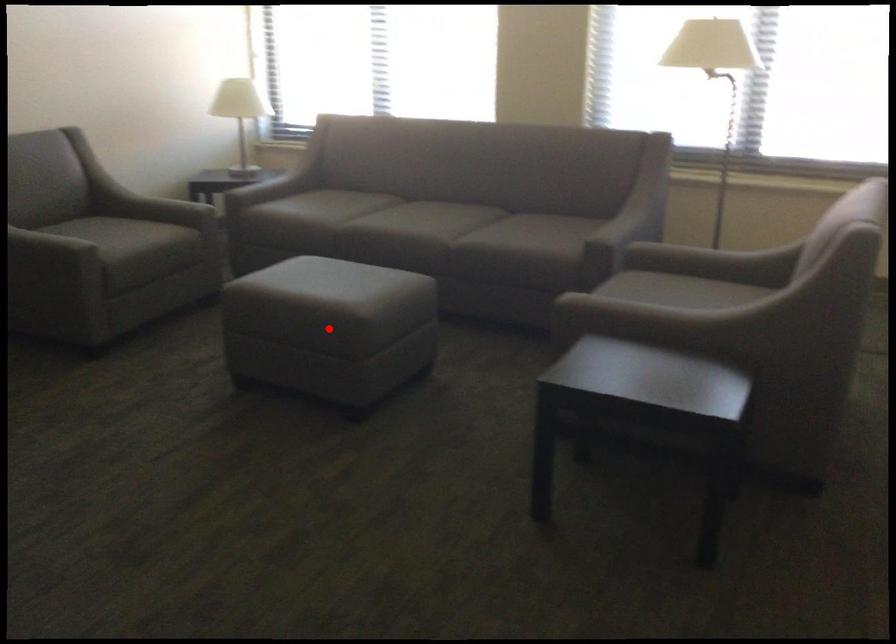
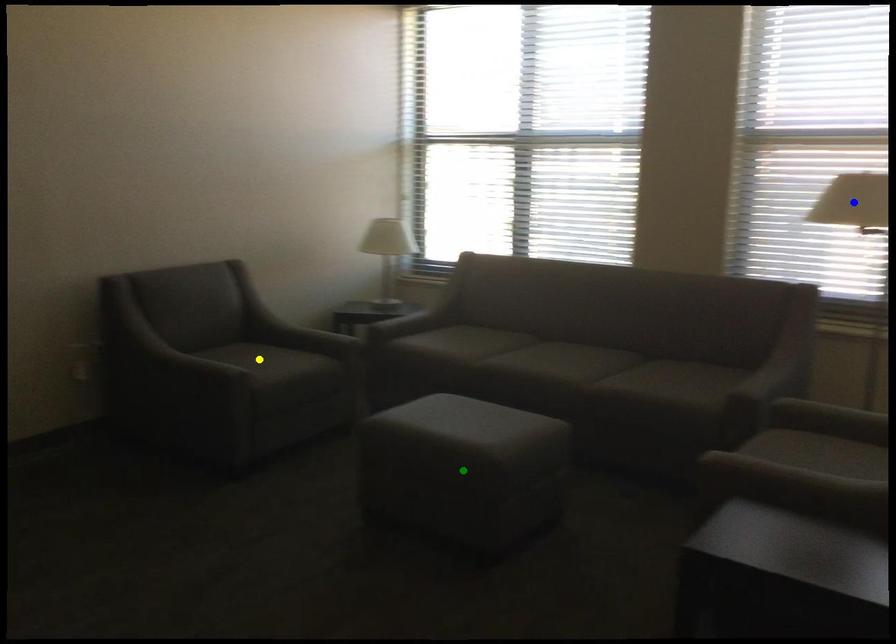
Question: I am providing you with two images of the same scene from different viewpoints. A red point is marked on the first image. You are given multiple points on the second image. Which mark in image 2 goes with the point in image 1?

Choices:
 (A) yellow point
 (B) green point
 (C) blue point

Answer: (B)